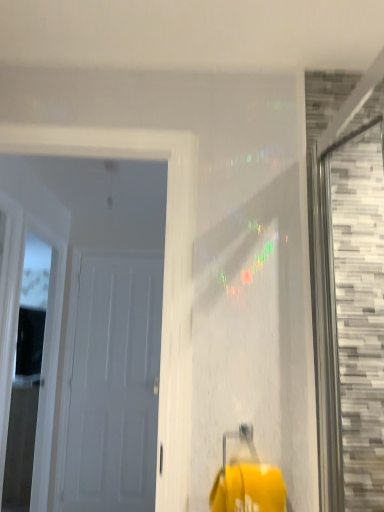
Question: Is white wood door at left, which is the 1th window in back-to-front order, positioned with its back to white matte door at left, the second door in the front-to-back sequence?

Choices:
 (A) no
 (B) yes

Answer: (A)

Question: Does white wood door at left, the second window positioned from the front, have a lesser height compared to white matte door at left, the 1th door in the back-to-front sequence?

Choices:
 (A) yes
 (B) no

Answer: (B)

Question: Is white wood door at left, the first window positioned from the left, bigger than white matte door at left, the second door in the front-to-back sequence?

Choices:
 (A) no
 (B) yes

Answer: (B)

Question: Is white wood door at left, placed as the second window when sorted from right to left, smaller than white matte door at left, the second door in the front-to-back sequence?

Choices:
 (A) no
 (B) yes

Answer: (A)

Question: From the image's perspective, is white wood door at left, which is the 1th window in back-to-front order, over white matte door at left, the 1th door in the back-to-front sequence?

Choices:
 (A) yes
 (B) no

Answer: (A)

Question: From the image's perspective, is gray mosaic tile at right, which is counted as the 2th window, starting from the left, positioned above or below white matte door at left, the second door in the front-to-back sequence?

Choices:
 (A) above
 (B) below

Answer: (A)

Question: Considering the positions of gray mosaic tile at right, which is counted as the 2th window, starting from the left, and white matte door at left, the 1th door in the back-to-front sequence, in the image, is gray mosaic tile at right, which is counted as the 2th window, starting from the left, taller or shorter than white matte door at left, the 1th door in the back-to-front sequence,?

Choices:
 (A) short
 (B) tall

Answer: (A)

Question: Based on their sizes in the image, would you say gray mosaic tile at right, marked as the first window in a right-to-left arrangement, is bigger or smaller than white matte door at left, the 1th door in the back-to-front sequence?

Choices:
 (A) big
 (B) small

Answer: (A)

Question: From a real-world perspective, is gray mosaic tile at right, arranged as the first window when viewed from the front, positioned above or below white matte door at left, the second door in the front-to-back sequence?

Choices:
 (A) below
 (B) above

Answer: (B)

Question: From a real-world perspective, is gray mosaic tile at right, which is counted as the 2th window, starting from the left, above or below white wood door at left, the second window positioned from the front?

Choices:
 (A) above
 (B) below

Answer: (A)

Question: In the image, is gray mosaic tile at right, which ranks as the second window in back-to-front order, on the left side or the right side of white wood door at left, which is the 1th window in back-to-front order?

Choices:
 (A) right
 (B) left

Answer: (A)

Question: Is gray mosaic tile at right, arranged as the first window when viewed from the front, bigger or smaller than white wood door at left, the first window positioned from the left?

Choices:
 (A) big
 (B) small

Answer: (B)

Question: Considering their positions, is gray mosaic tile at right, which ranks as the second window in back-to-front order, located in front of or behind white wood door at left, placed as the second window when sorted from right to left?

Choices:
 (A) front
 (B) behind

Answer: (A)

Question: In the image, is white matte door at left, the 1th door in the back-to-front sequence, positioned in front of or behind white wood door at left, which is the 1th window in back-to-front order?

Choices:
 (A) front
 (B) behind

Answer: (B)

Question: Considering the relative positions of white matte door at left, the second door in the front-to-back sequence, and white wood door at left, the first window positioned from the left, in the image provided, is white matte door at left, the second door in the front-to-back sequence, to the left or to the right of white wood door at left, the first window positioned from the left,?

Choices:
 (A) right
 (B) left

Answer: (A)